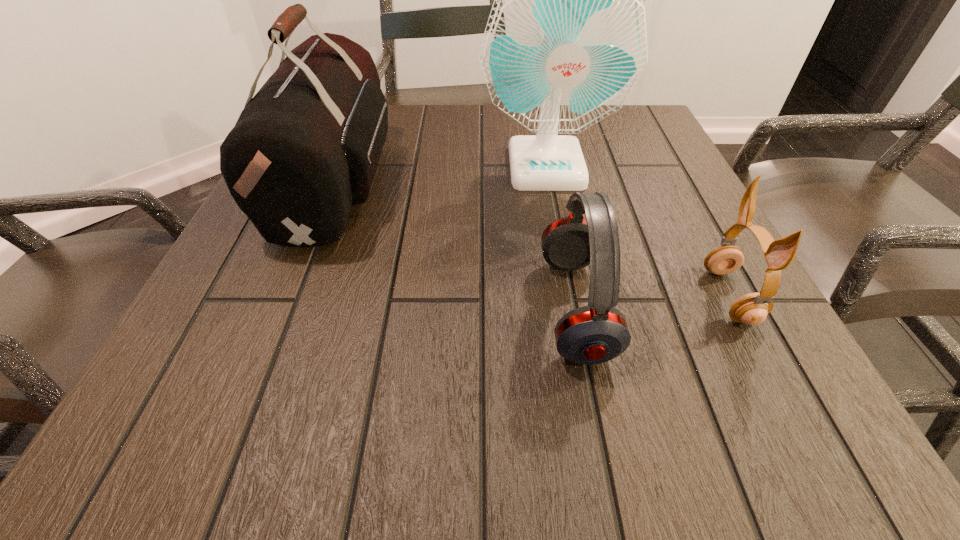
Image resolution: width=960 pixels, height=540 pixels. I want to click on vacant space at the far edge, so click(506, 152).

Identify the location of free space at the left edge. Image resolution: width=960 pixels, height=540 pixels. (242, 285).

In the image, there is a desktop. What are the coordinates of `vacant space at the right edge` in the screenshot? It's located at (684, 176).

In the image, there is a desktop. Identify the location of vacant space at the near left corner. (139, 450).

This screenshot has width=960, height=540. I want to click on vacant space at the far right corner of the desktop, so click(x=653, y=121).

In order to click on empty space between the right earphone and the fan in this screenshot , I will do `click(637, 231)`.

Find the location of `empty location between the rightmost object and the duffel bag`. empty location between the rightmost object and the duffel bag is located at coordinates (533, 238).

Image resolution: width=960 pixels, height=540 pixels. I want to click on free spot between the tallest object and the right earphone, so click(x=637, y=231).

Locate an element on the screen. free space between the tallest object and the right earphone is located at coordinates (637, 231).

You are a GUI agent. You are given a task and a screenshot of the screen. Output one action in this format:
    pyautogui.click(x=<x>, y=<y>)
    Task: Click on the empty location between the right earphone and the second tallest object
    
    Given the screenshot: What is the action you would take?
    pyautogui.click(x=533, y=238)